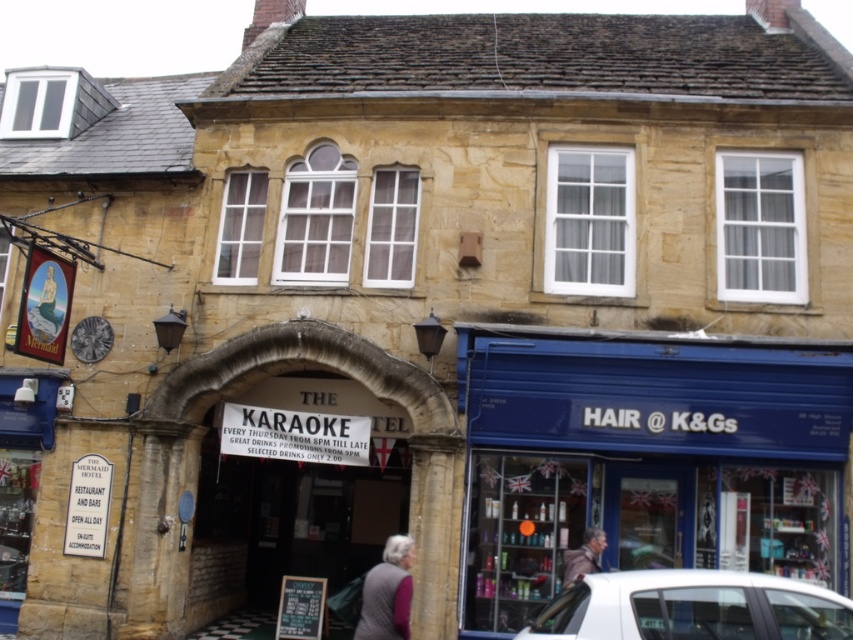
You are standing in front of the two story stone building and see both the gray woolen sweater at lower center and the light brown leather jacket at lower center. Which item is nearer to you?

The gray woolen sweater at lower center is closer to the viewer than the light brown leather jacket at lower center.